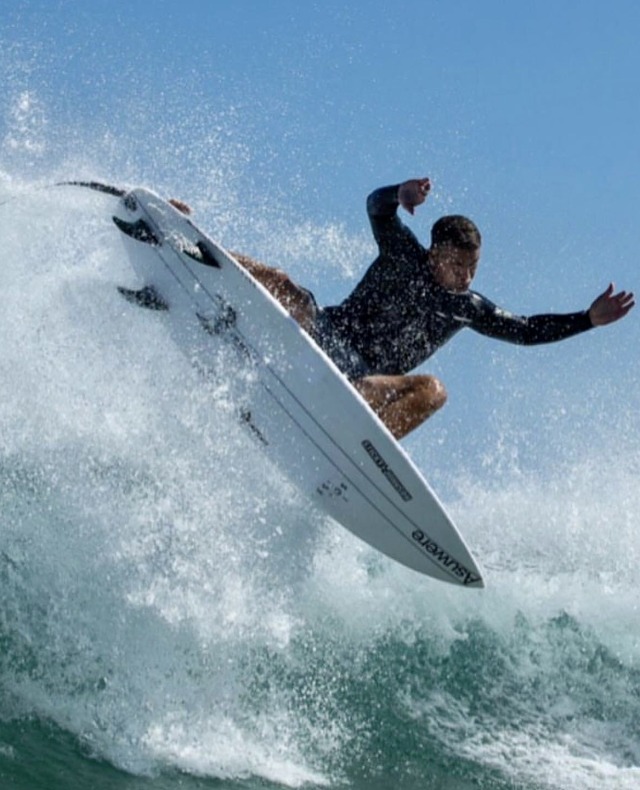
You are a GUI agent. You are given a task and a screenshot of the screen. Output one action in this format:
    pyautogui.click(x=<x>, y=<y>)
    Task: Click on the board
    This screenshot has height=790, width=640.
    Given the screenshot: What is the action you would take?
    pyautogui.click(x=393, y=532)